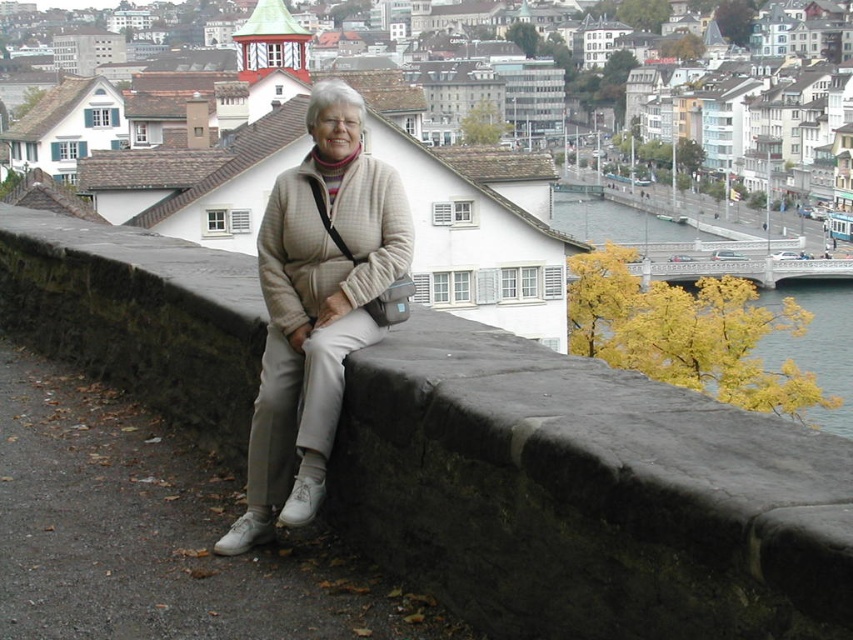
You are a photographer trying to capture the beige woolen sweater at center in your shot. Based on its position, where should you aim your camera?

The beige woolen sweater at center is located at the 2D coordinates point (x=316, y=307), so aim your camera towards that point to capture it.

You are standing at the camera position and want to place a 20 meter long banner between yourself and the dark gray stone ledge at center. Is the distance sufficient for the banner to fit entirely without overlapping the ledge?

The distance between the camera and the dark gray stone ledge at center is 18.77 meters, which is shorter than the 20 meter banner. Therefore, the banner cannot fit entirely without overlapping the ledge.

You are a photographer trying to capture a shot of the dark gray stone ledge at center and the yellow leafy tree at upper right. Which object should you adjust your camera to focus on first if you want to include both in your frame?

You should focus on the dark gray stone ledge at center first because it is positioned on the left side of the yellow leafy tree at upper right, so adjusting the camera to include both would require starting with the ledge and then framing the tree to its right.